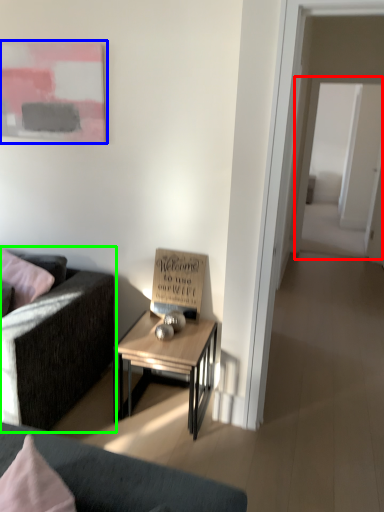
Question: Based on their relative distances, which object is farther from glass door (highlighted by a red box)? Choose from picture frame (highlighted by a blue box) and studio couch (highlighted by a green box).

Choices:
 (A) picture frame
 (B) studio couch

Answer: (B)